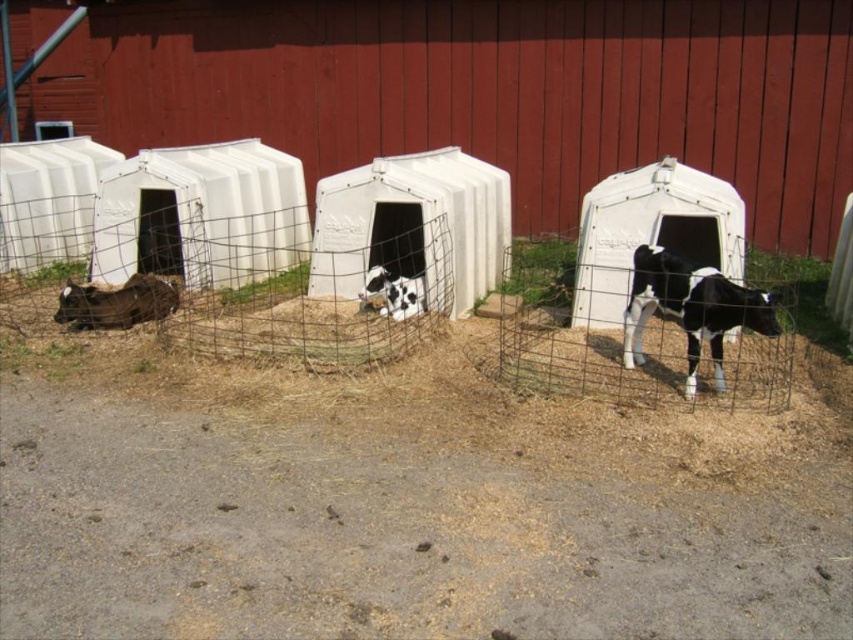
Question: Among these points, which one is farthest from the camera?

Choices:
 (A) (x=148, y=308)
 (B) (x=372, y=298)
 (C) (x=659, y=300)

Answer: (B)

Question: Which object is positioned closest to the brown fuzzy calf at lower left?

Choices:
 (A) black and white spotted calf at center
 (B) black and white spotted calf at right

Answer: (A)

Question: Is black and white spotted calf at right positioned behind black and white spotted calf at center?

Choices:
 (A) yes
 (B) no

Answer: (B)

Question: Estimate the real-world distances between objects in this image. Which object is farther from the black and white spotted calf at center?

Choices:
 (A) black and white spotted calf at right
 (B) brown fuzzy calf at lower left

Answer: (A)

Question: Is black and white spotted calf at right behind brown fuzzy calf at lower left?

Choices:
 (A) no
 (B) yes

Answer: (A)

Question: Does brown fuzzy calf at lower left come in front of black and white spotted calf at center?

Choices:
 (A) yes
 (B) no

Answer: (A)